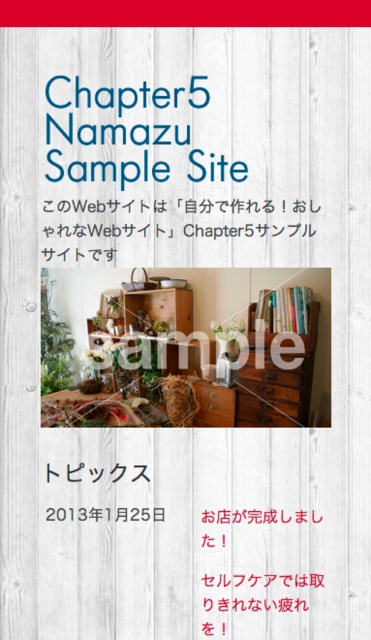
Does wooden bookshelf at center have a smaller size compared to hardcover books at upper center?

Actually, wooden bookshelf at center might be larger than hardcover books at upper center.

Is the position of wooden bookshelf at center more distant than that of hardcover books at upper center?

Yes, it is behind hardcover books at upper center.

Is point (188, 300) less distant than point (268, 305)?

That is False.

This screenshot has width=371, height=640. I want to click on wooden bookshelf at center, so click(x=150, y=307).

Is wooden chest of drawers at center-right below wooden bookshelf at center?

Yes, wooden chest of drawers at center-right is below wooden bookshelf at center.

Who is positioned more to the left, wooden chest of drawers at center-right or wooden bookshelf at center?

From the viewer's perspective, wooden bookshelf at center appears more on the left side.

Measure the distance between point (250, 346) and camera.

Point (250, 346) is 3.48 meters away from camera.

The image size is (371, 640). Identify the location of wooden chest of drawers at center-right. (278, 378).

Which is behind, point (270, 308) or point (293, 308)?

Positioned behind is point (270, 308).

The height and width of the screenshot is (640, 371). In order to click on wooden chest of drawers at center-right in this screenshot , I will do `click(278, 378)`.